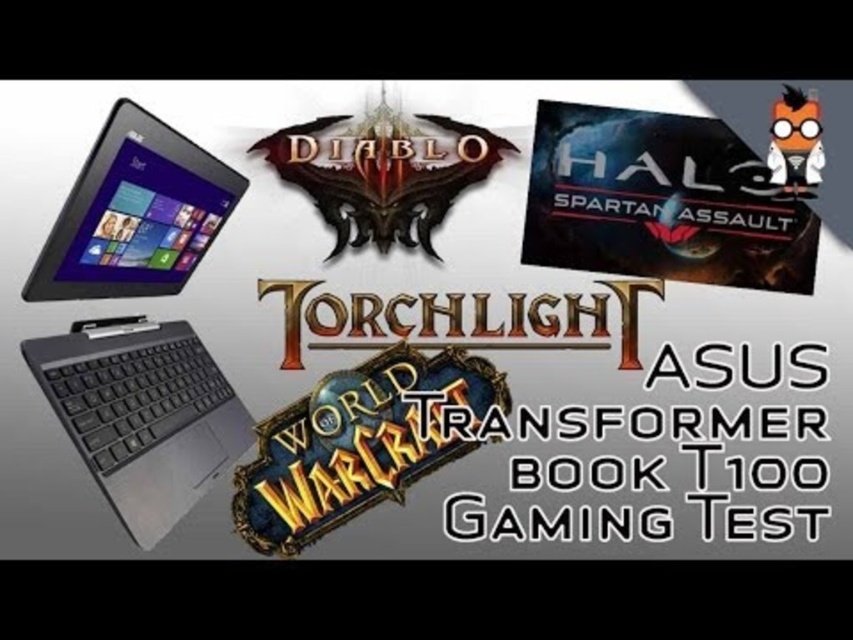
You are a gamer looking at the promotional graphic for the ASUS Transformer Book T100. You notice two devices at the left side of the image. Which device is closer to you, the black matte asus transformer book t100 at left or the matte black tablet at left?

The black matte asus transformer book t100 at left is closer to you because it is in front of the matte black tablet at left.

You are looking at the promotional graphic for a gaming test. You see the black matte asus transformer book t100 at left and the matte black tablet at left. Which one is positioned more to the right?

The black matte asus transformer book t100 at left is positioned more to the right than the matte black tablet at left.

You are holding a ruler and want to measure the distance between the black matte asus transformer book t100 at left and the matte black tablet at left in the promotional graphic. According to the description, how far apart are they?

The black matte asus transformer book t100 at left is 3.84 centimeters away from the matte black tablet at left.